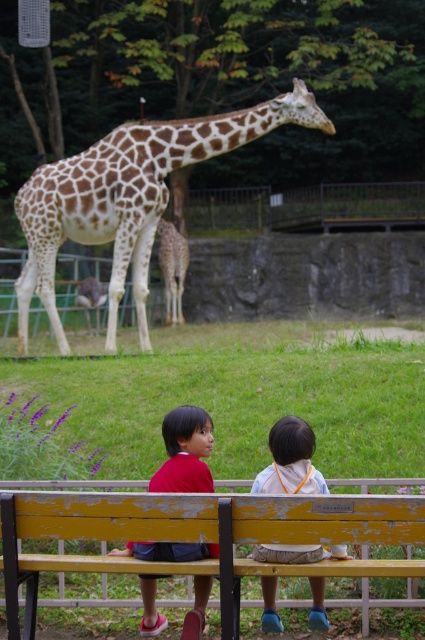
At what (x,y) coordinates should I click in order to perform the action: click on wooden bench at center. Please return your answer as a coordinate pair (x, y). Looking at the image, I should click on (212, 536).

From the picture: Between wooden bench at center and light blue fabric shirt at center, which one appears on the left side from the viewer's perspective?

From the viewer's perspective, wooden bench at center appears more on the left side.

Does point (8, 564) come closer to viewer compared to point (314, 580)?

Yes, point (8, 564) is in front of point (314, 580).

You are a GUI agent. You are given a task and a screenshot of the screen. Output one action in this format:
    pyautogui.click(x=<x>, y=<y>)
    Task: Click on the wooden bench at center
    The image size is (425, 640).
    Given the screenshot: What is the action you would take?
    pyautogui.click(x=212, y=536)

Between light blue fabric shirt at center and spotted fur giraffe at center, which one has less height?

With less height is light blue fabric shirt at center.

Between point (252, 556) and point (176, 284), which one is positioned behind?

The point (176, 284) is behind.

Is point (320, 552) behind point (161, 243)?

No.

This screenshot has height=640, width=425. Identify the location of light blue fabric shirt at center. (291, 460).

Identify the location of wooden bench at center. (212, 536).

Looking at this image, between wooden bench at center and spotted fur giraffe at center, which one is positioned lower?

wooden bench at center

Does point (129, 493) come behind point (164, 262)?

No, (129, 493) is closer to viewer.

Locate an element on the screen. The width and height of the screenshot is (425, 640). wooden bench at center is located at coordinates (212, 536).